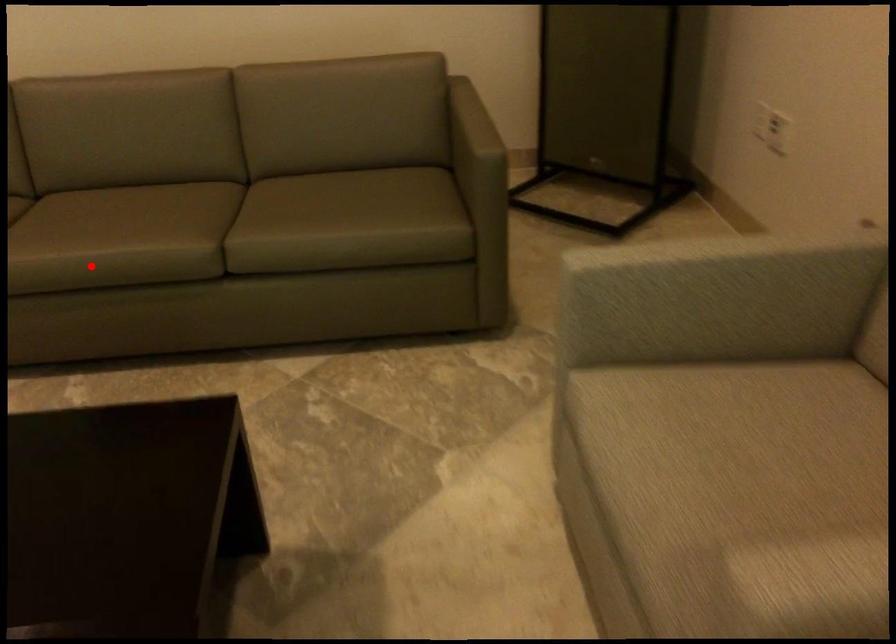
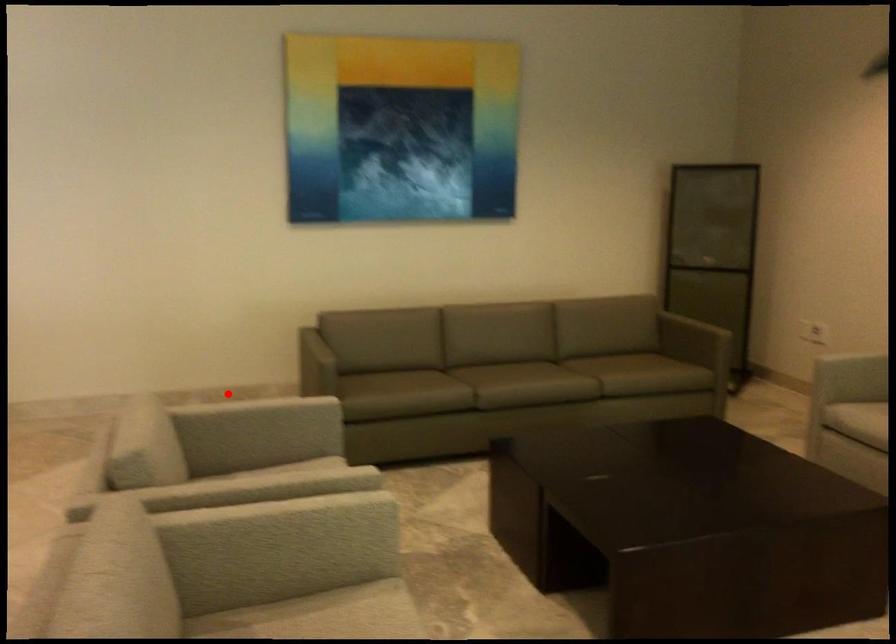
I am providing you with two images of the same scene from different viewpoints. A red point is marked on the first image and another point is marked on the second image. Are the points marked in image1 and image2 representing the same 3D position?

No